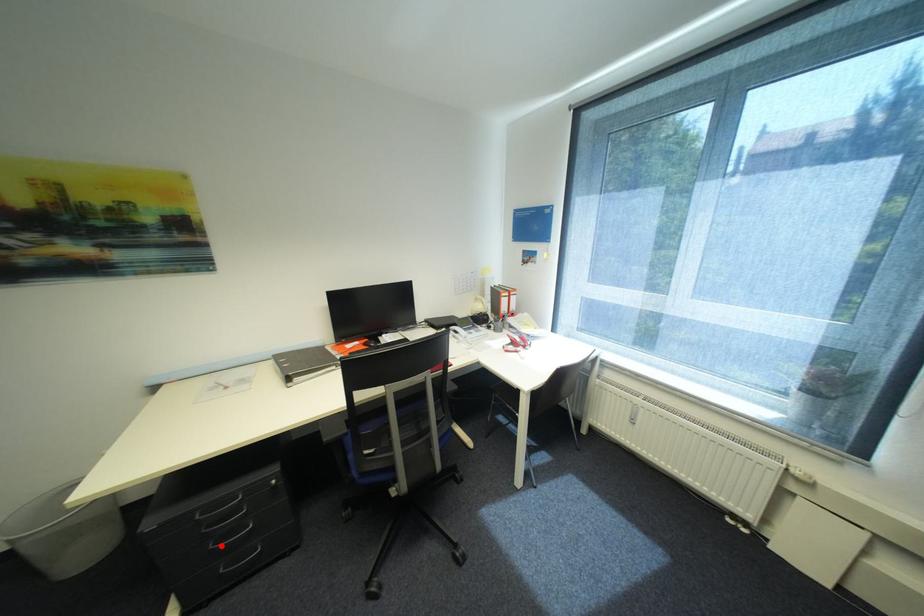
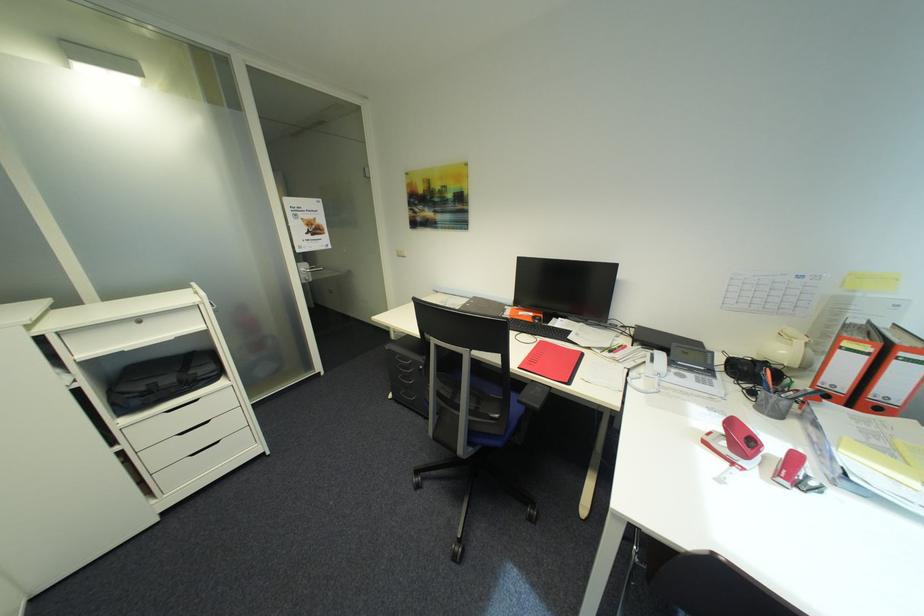
Question: I am providing you with two images of the same scene from different viewpoints. Image1 has a red point marked. In image2, the corresponding 3D location appears at what relative position? Reply with the corresponding letter.

Choices:
 (A) Closer
 (B) Farther

Answer: (B)